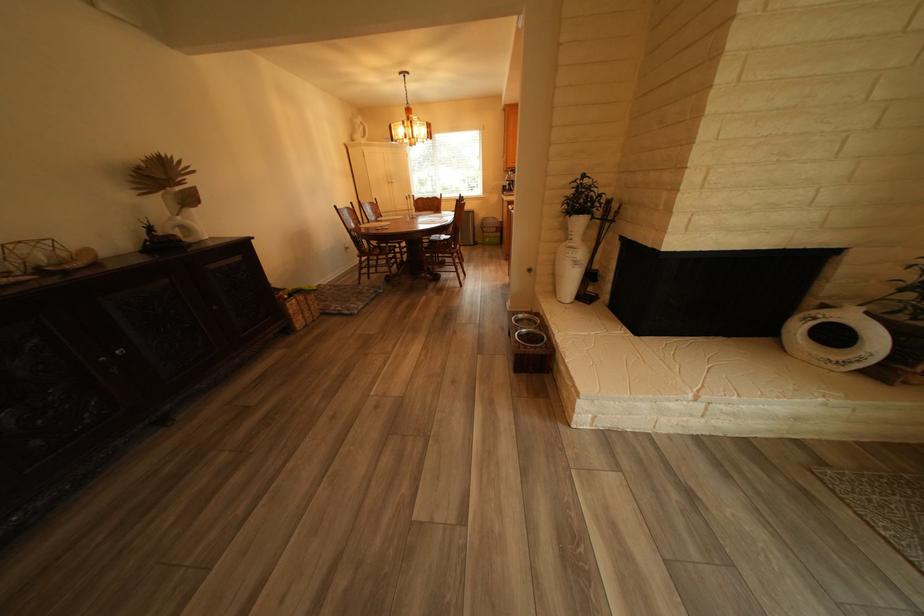
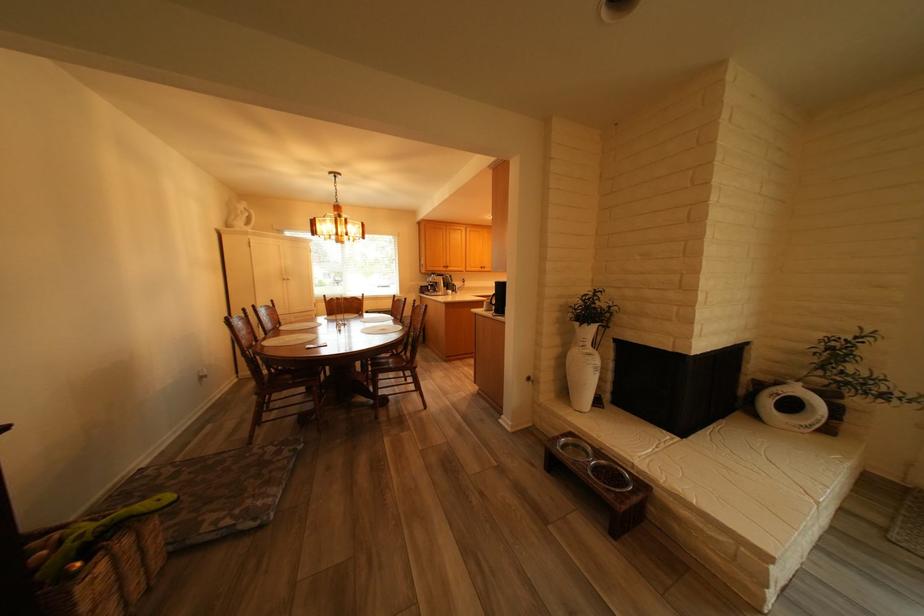
Where in the second image is the point corresponding to [371,128] from the first image?

(253, 213)